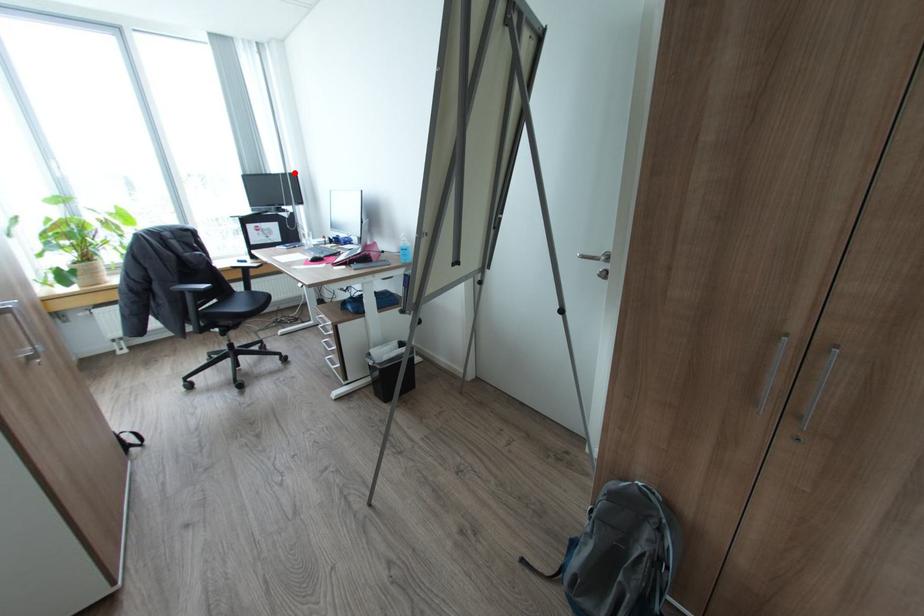
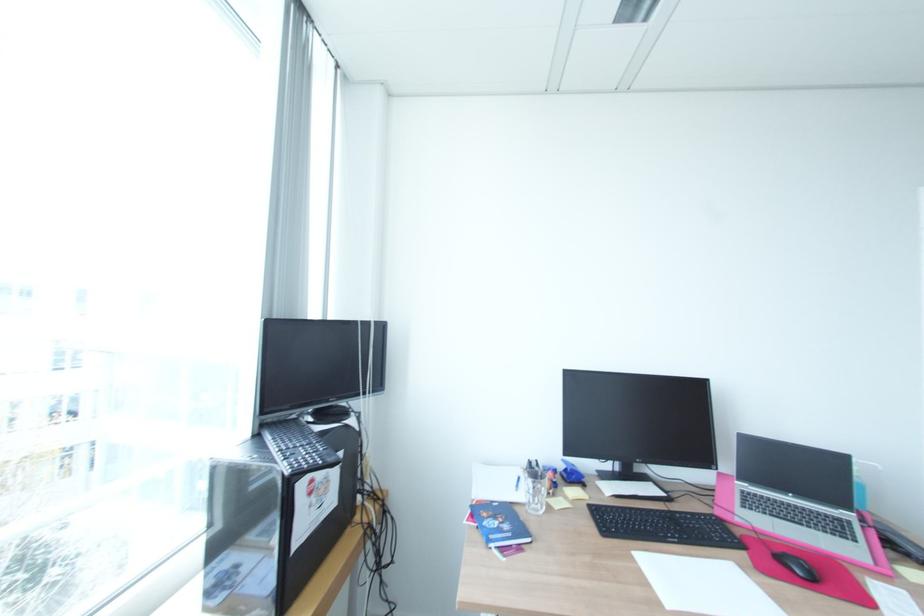
Question: I am providing you with two images of the same scene from different viewpoints. A red point is shown in image1. For the corresponding object point in image2, is it positioned nearer or farther from the camera?

Choices:
 (A) Nearer
 (B) Farther

Answer: (B)